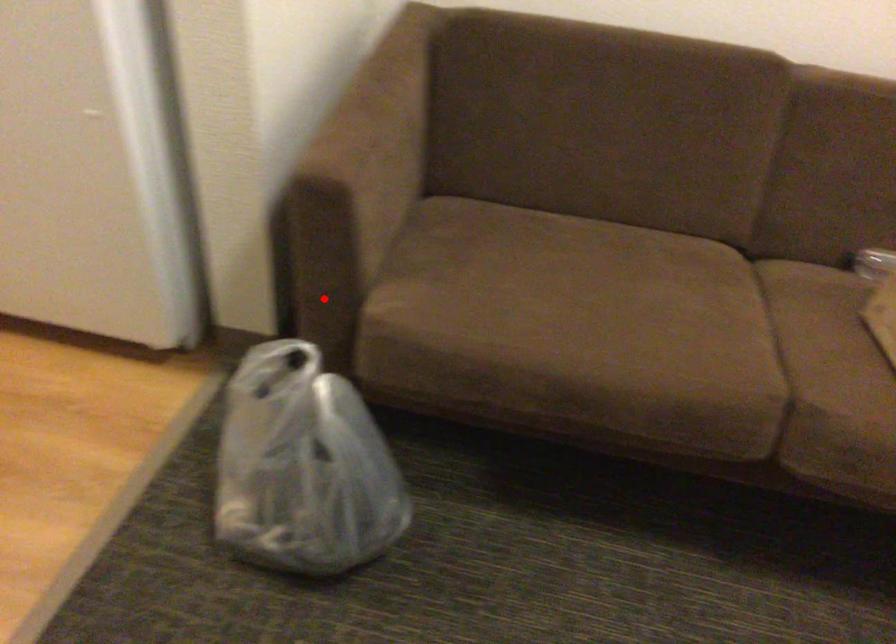
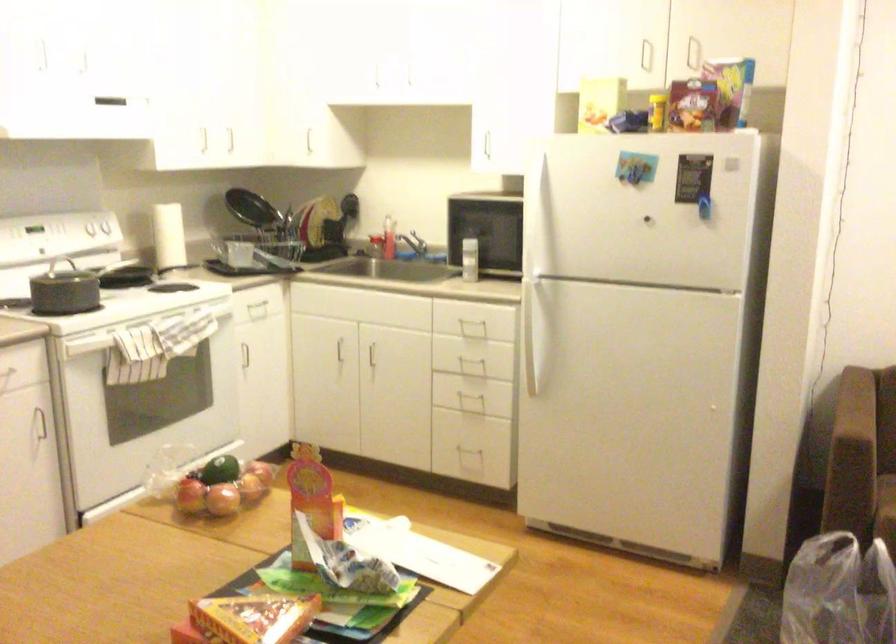
Find the pixel in the second image that matches the highlighted location in the first image.

(863, 513)